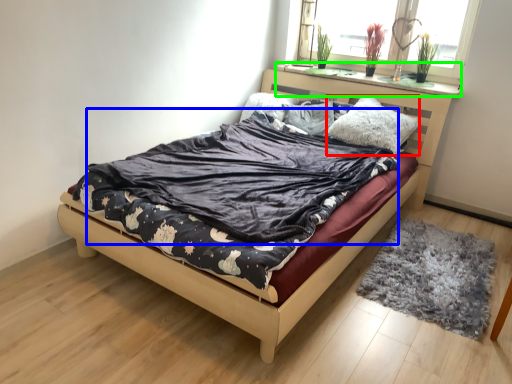
Question: Based on their relative distances, which object is nearer to pillow (highlighted by a red box)? Choose from blanket (highlighted by a blue box) and window sill (highlighted by a green box).

Choices:
 (A) blanket
 (B) window sill

Answer: (B)